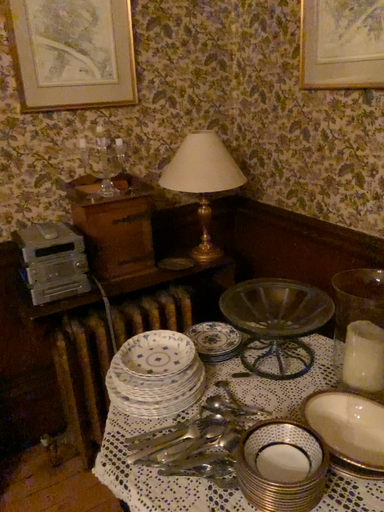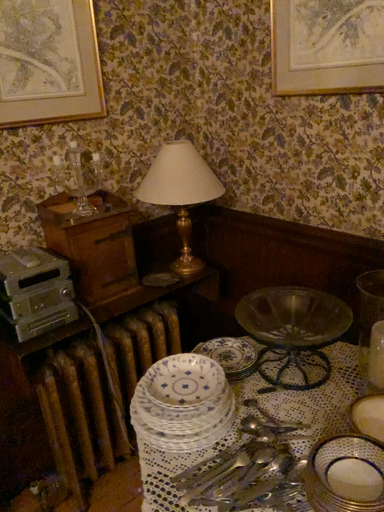
Question: How did the camera likely rotate when shooting the video?

Choices:
 (A) rotated left
 (B) rotated right

Answer: (B)